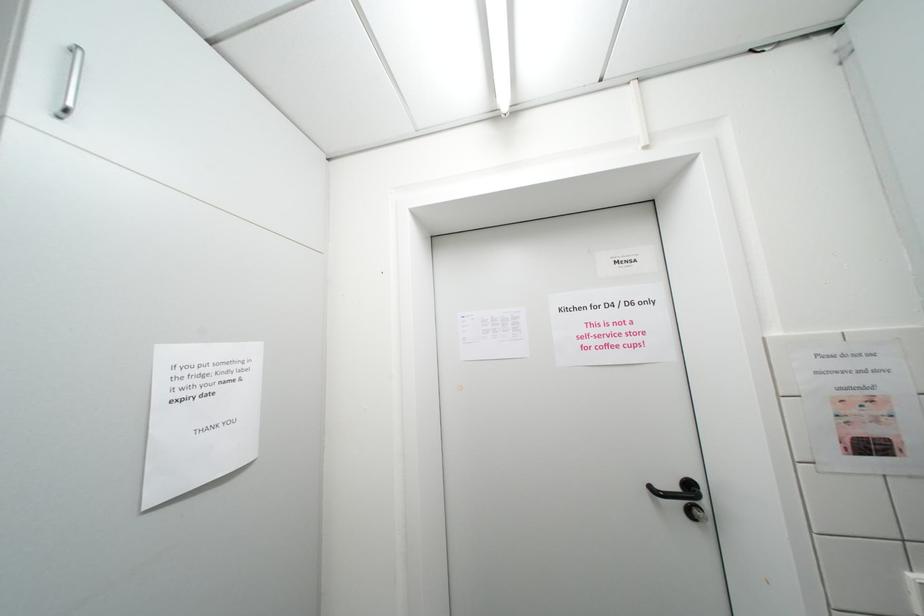
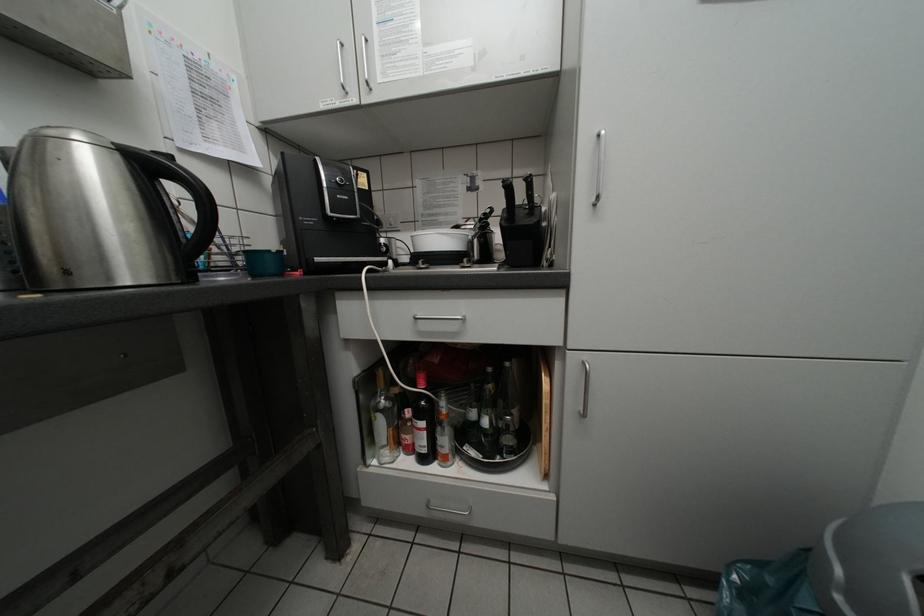
Question: The images are taken continuously from a first-person perspective. In which direction is your viewpoint rotating?

Choices:
 (A) Left
 (B) Right
 (C) Up
 (D) Down

Answer: (A)